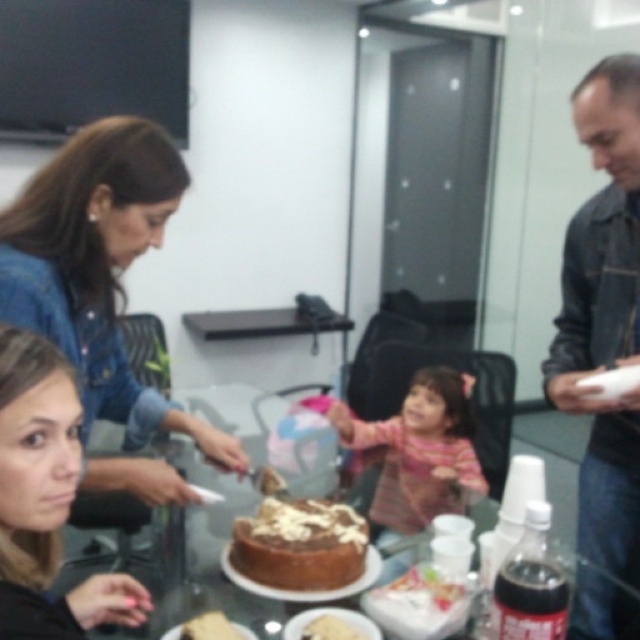
You are a guest at this gathering and want to place a small gift on the table. The gift is 10 cm tall. You need to choose between placing it on the denim jacket at upper left or the striped fabric at center. Which surface can accommodate the gift without it toppling over?

The denim jacket at upper left has a greater height compared to striped fabric at center, so placing the gift on the denim jacket at upper left would be more stable as it can support the gift without toppling over.

You are holding a camera and want to take a closeup photo of the smooth skin face at lower left. The camera requires the subject to be at least 24 inches away for optimal focus. Is the current distance sufficient?

The smooth skin face at lower left and camera are 24.55 inches apart, which is just enough to meet the 24 inch minimum requirement for optimal focus.